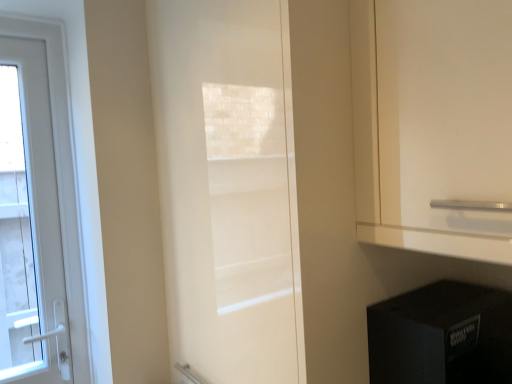
Question: Can you confirm if black plastic speaker at lower right is thinner than white glossy door at center, marked as the 1th door in a right-to-left arrangement?

Choices:
 (A) no
 (B) yes

Answer: (B)

Question: From a real-world perspective, is black plastic speaker at lower right below white glossy door at center, positioned as the 2th door in left-to-right order?

Choices:
 (A) yes
 (B) no

Answer: (A)

Question: Does black plastic speaker at lower right have a smaller size compared to white glossy door at center, which is the 1th door in front-to-back order?

Choices:
 (A) no
 (B) yes

Answer: (B)

Question: Is black plastic speaker at lower right directly adjacent to white glossy door at center, the 2th door when ordered from back to front?

Choices:
 (A) no
 (B) yes

Answer: (A)

Question: From the image's perspective, is black plastic speaker at lower right on top of white glossy door at center, positioned as the 2th door in left-to-right order?

Choices:
 (A) no
 (B) yes

Answer: (A)

Question: Visually, is black plastic speaker at lower right positioned to the left or to the right of white glossy door at left, acting as the first door starting from the left?

Choices:
 (A) left
 (B) right

Answer: (B)

Question: In terms of width, does black plastic speaker at lower right look wider or thinner when compared to white glossy door at left, arranged as the second door when viewed from the right?

Choices:
 (A) wide
 (B) thin

Answer: (A)

Question: Is point (432, 284) closer or farther from the camera than point (9, 102)?

Choices:
 (A) closer
 (B) farther

Answer: (A)

Question: Based on their sizes in the image, would you say black plastic speaker at lower right is bigger or smaller than white glossy door at left, arranged as the second door when viewed from the right?

Choices:
 (A) big
 (B) small

Answer: (A)

Question: From the image's perspective, is black plastic speaker at lower right positioned above or below white glossy door at center, positioned as the 2th door in left-to-right order?

Choices:
 (A) below
 (B) above

Answer: (A)

Question: Based on their sizes in the image, would you say black plastic speaker at lower right is bigger or smaller than white glossy door at center, marked as the 1th door in a right-to-left arrangement?

Choices:
 (A) small
 (B) big

Answer: (A)

Question: From a real-world perspective, is black plastic speaker at lower right above or below white glossy door at center, which is the 1th door in front-to-back order?

Choices:
 (A) above
 (B) below

Answer: (B)

Question: Is black plastic speaker at lower right wider or thinner than white glossy door at center, which is the 1th door in front-to-back order?

Choices:
 (A) wide
 (B) thin

Answer: (B)

Question: In terms of height, does white glossy door at left, marked as the second door in a front-to-back arrangement, look taller or shorter compared to black plastic speaker at lower right?

Choices:
 (A) short
 (B) tall

Answer: (B)

Question: Considering their positions, is white glossy door at left, placed as the 1th door when sorted from back to front, located in front of or behind black plastic speaker at lower right?

Choices:
 (A) front
 (B) behind

Answer: (B)